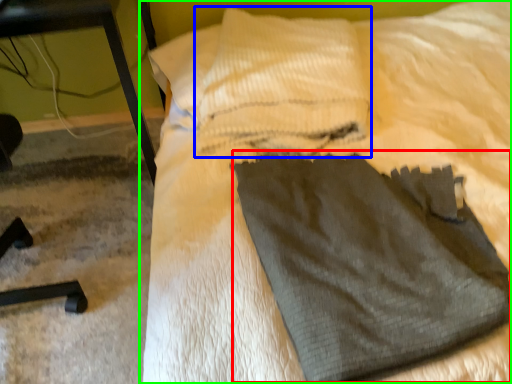
Question: Which object is the closest to the sweat pant (highlighted by a red box)? Choose among these: pillow (highlighted by a blue box) or bed (highlighted by a green box).

Choices:
 (A) pillow
 (B) bed

Answer: (B)